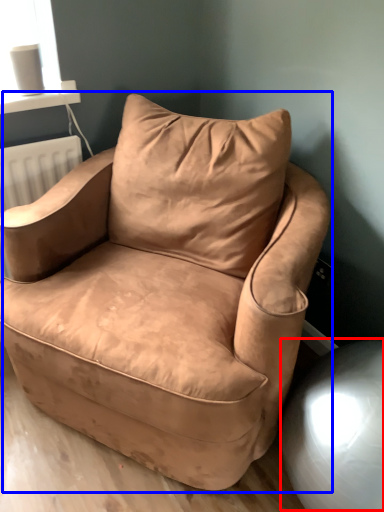
Question: Which object is closer to the camera taking this photo, swivel chair (highlighted by a red box) or chair (highlighted by a blue box)?

Choices:
 (A) swivel chair
 (B) chair

Answer: (B)